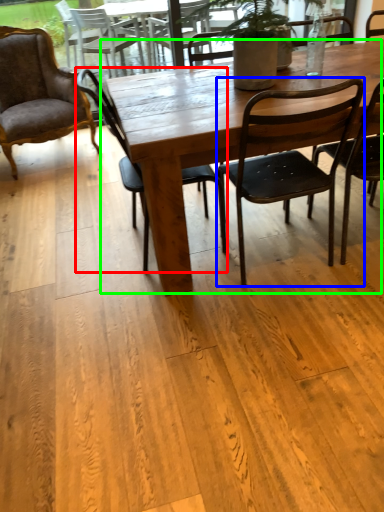
Question: Which is nearer to the chair (highlighted by a red box)? chair (highlighted by a blue box) or kitchen & dining room table (highlighted by a green box).

Choices:
 (A) chair
 (B) kitchen & dining room table

Answer: (B)